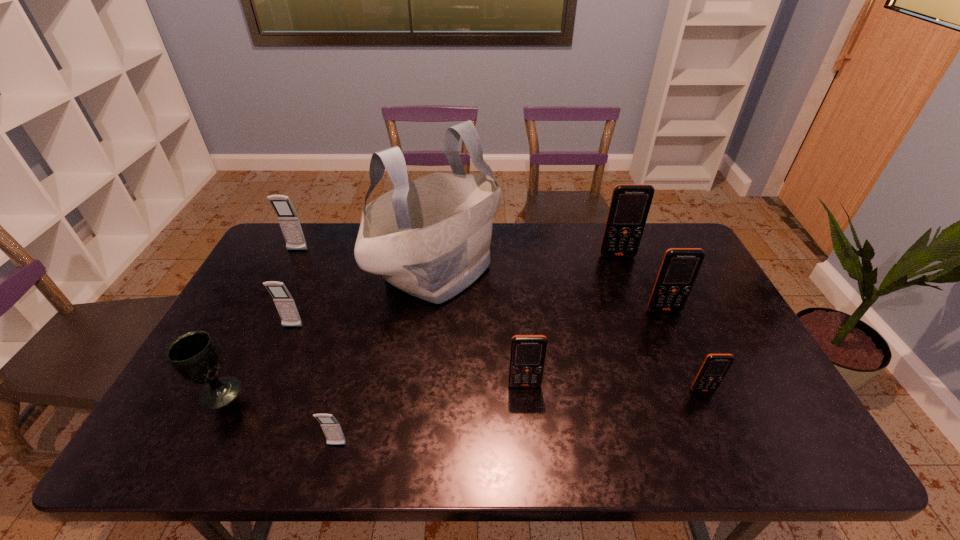
The width and height of the screenshot is (960, 540). What are the coordinates of `the third biggest orange cellular telephone` in the screenshot? It's located at (527, 357).

Where is `chalice`? Image resolution: width=960 pixels, height=540 pixels. chalice is located at coordinates (194, 355).

In order to click on the smallest orange cellular telephone in this screenshot , I will do `click(715, 366)`.

I want to click on the nearest gray cellular telephone, so pyautogui.click(x=331, y=427).

This screenshot has height=540, width=960. I want to click on the rightmost gray cellular telephone, so click(x=331, y=427).

The width and height of the screenshot is (960, 540). In order to click on free space located 0.270m on the left of the tallest object in this screenshot , I will do `click(293, 270)`.

The width and height of the screenshot is (960, 540). In order to click on free location located 0.200m on the screen of the tallest cellular telephone in this screenshot , I will do `click(635, 300)`.

Identify the location of vacant region located on the front-facing side of the biggest gray cellular telephone. (281, 282).

You are a GUI agent. You are given a task and a screenshot of the screen. Output one action in this format:
    pyautogui.click(x=<x>, y=<y>)
    Task: Click on the free space located on the screen of the third farthest cellular telephone
    This screenshot has height=540, width=960.
    Given the screenshot: What is the action you would take?
    pyautogui.click(x=694, y=379)

Locate an element on the screen. This screenshot has width=960, height=540. vacant space situated on the front-facing side of the second smallest gray cellular telephone is located at coordinates (252, 420).